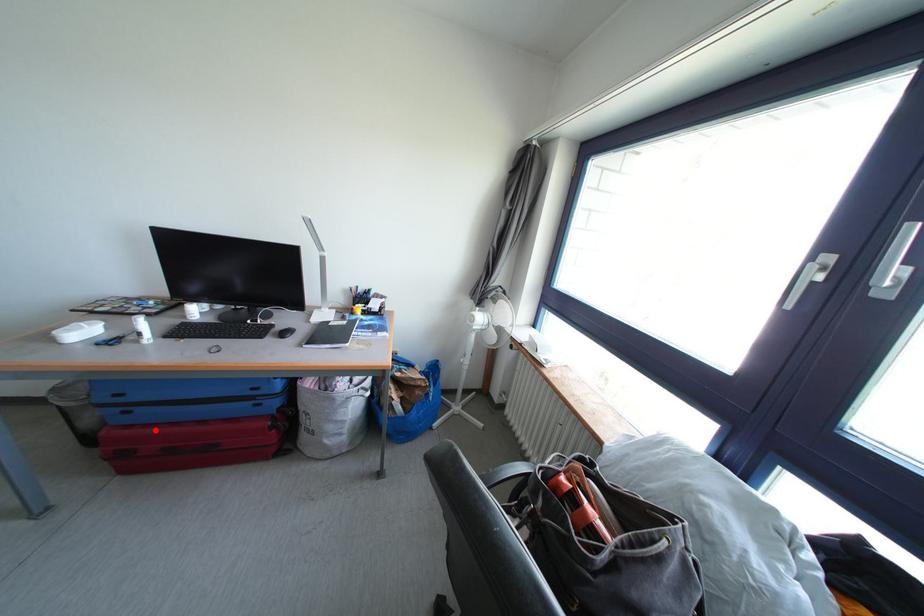
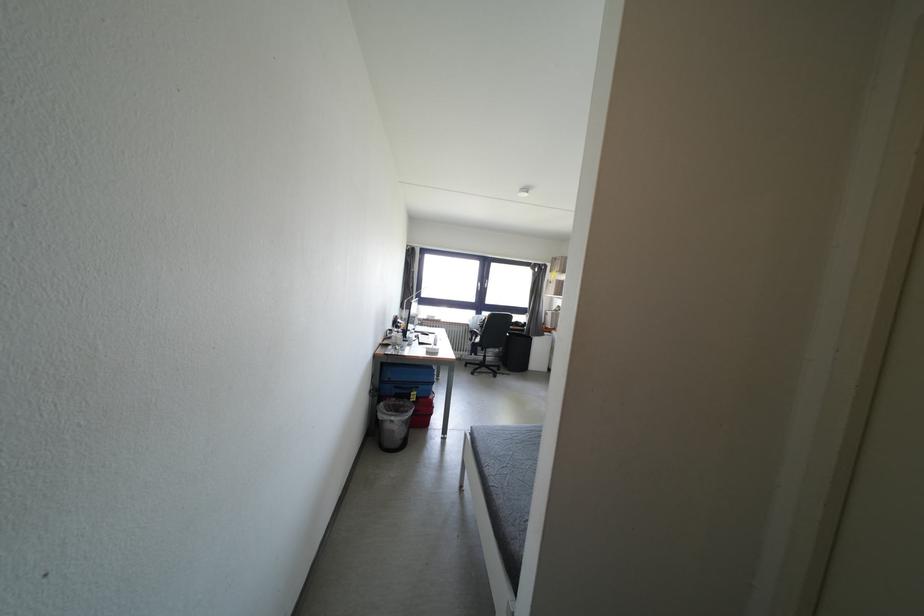
Question: I am providing you with two images of the same scene from different viewpoints. A red point is marked on the first image. Is the red point's position out of view in image 2?

Choices:
 (A) Yes
 (B) No

Answer: (A)